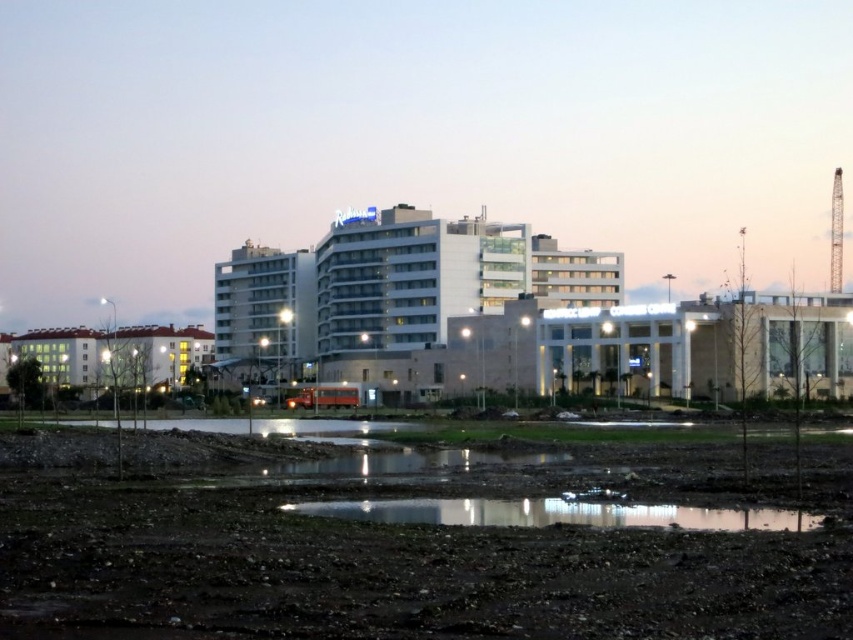
Question: Is glossy concrete puddle at lower center closer to camera compared to white matte building at lower left?

Choices:
 (A) yes
 (B) no

Answer: (A)

Question: Can you confirm if dull brown dirt at lower center is smaller than glossy concrete puddle at lower center?

Choices:
 (A) no
 (B) yes

Answer: (A)

Question: Which object is positioned closest to the dull brown dirt at lower center?

Choices:
 (A) white matte building at lower left
 (B) white glass building at center

Answer: (A)

Question: Which of the following is the farthest from the observer?

Choices:
 (A) white matte building at lower left
 (B) glossy concrete puddle at lower center
 (C) white glass building at center
 (D) dull brown dirt at lower center

Answer: (C)

Question: Is glossy concrete puddle at lower center smaller than white matte building at lower left?

Choices:
 (A) yes
 (B) no

Answer: (A)

Question: Which object is the closest to the white matte building at lower left?

Choices:
 (A) dull brown dirt at lower center
 (B) glossy concrete puddle at lower center
 (C) white glass building at center

Answer: (C)